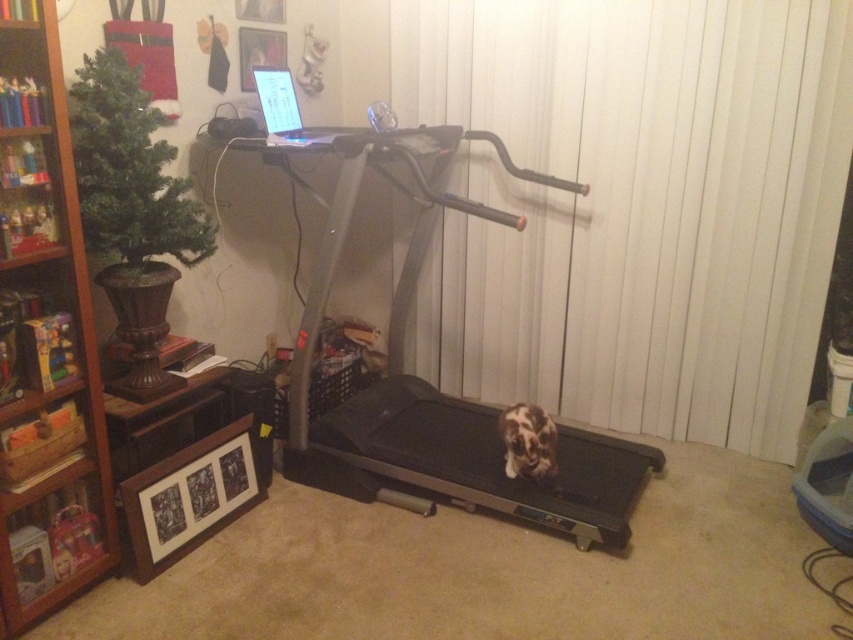
You are setting up a home office and want to place your new bookshelf so that it is to the right of your treadmill. Based on the scene described, is the current placement of the wooden bookshelf at left and silver metallic treadmill at center suitable for your needs?

The wooden bookshelf at left is positioned on the left side of the silver metallic treadmill at center, meaning it is currently to the left rather than the right. To meet your requirement of having the bookshelf to the right of the treadmill, you would need to reposition it.

You are a delivery person who needs to place a package that is 1.2 meters long between the wooden bookshelf at left and the silver metallic treadmill at center. Can you fit the package horizontally between them without moving either object?

The wooden bookshelf at left and silver metallic treadmill at center are 1.09 meters apart from each other, so the package that is 1.2 meters long cannot fit horizontally between them as the distance is shorter than the package length.

You are planning to hang a picture frame on the wall behind the wooden bookshelf at left and the silver metallic treadmill at center. Which object will have the picture frame placed higher up on the wall?

The wooden bookshelf at left is taller than the silver metallic treadmill at center, so the picture frame will be placed higher up on the wall behind the wooden bookshelf at left.